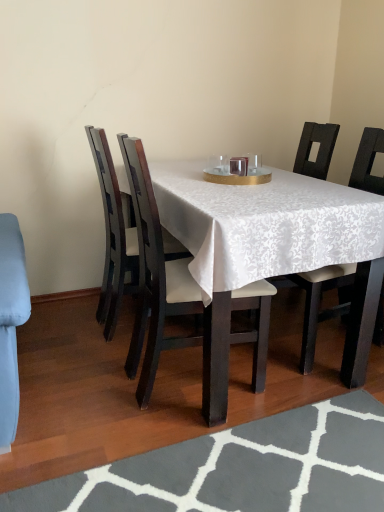
Image resolution: width=384 pixels, height=512 pixels. In order to click on free space to the left of dark wood chair at left, which is counted as the 1th chair, starting from the left in this screenshot , I will do `click(54, 335)`.